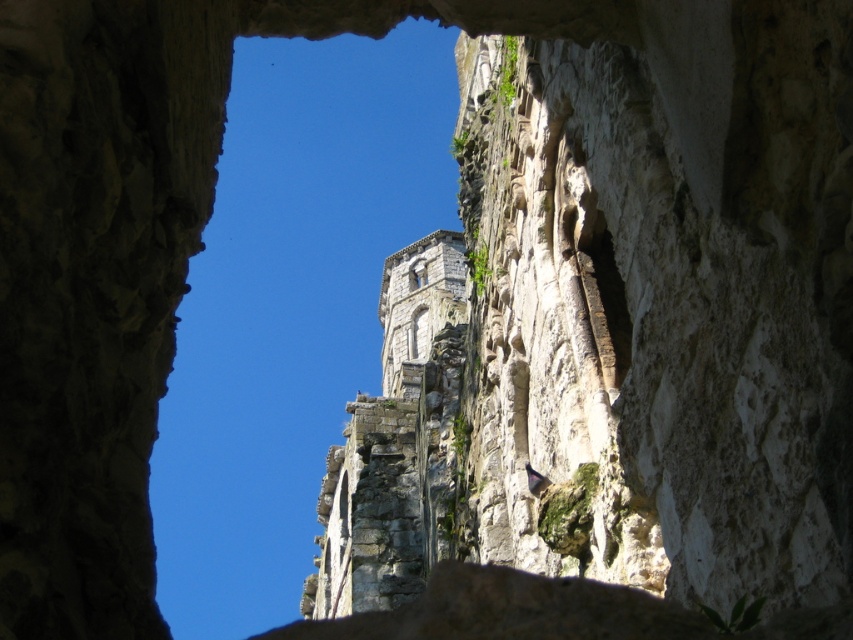
Does point (410, 340) come in front of point (418, 282)?

Yes, point (410, 340) is in front of point (418, 282).

You are a GUI agent. You are given a task and a screenshot of the screen. Output one action in this format:
    pyautogui.click(x=<x>, y=<y>)
    Task: Click on the stone textured window at center
    The width and height of the screenshot is (853, 640).
    Given the screenshot: What is the action you would take?
    pyautogui.click(x=418, y=333)

Between stone archway at center and clear glass window at center, which one appears on the left side from the viewer's perspective?

From the viewer's perspective, stone archway at center appears more on the left side.

This screenshot has height=640, width=853. What are the coordinates of `stone archway at center` in the screenshot? It's located at pyautogui.click(x=289, y=307).

Is gray stone tower at center to the right of clear glass window at center from the viewer's perspective?

Yes, gray stone tower at center is to the right of clear glass window at center.

Does point (410, 333) lie behind point (413, 266)?

No, (410, 333) is closer to viewer.

I want to click on gray stone tower at center, so click(x=418, y=307).